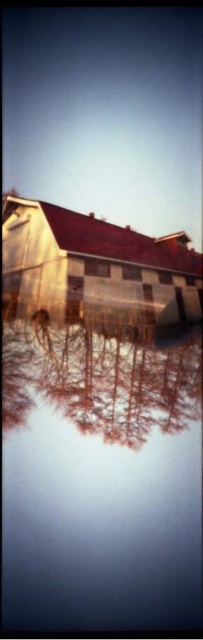
Between transparent glass water at center and wooden barn at center, which one has more height?

transparent glass water at center is taller.

Is point (143, 426) positioned after point (87, 216)?

That is False.

The width and height of the screenshot is (203, 640). I want to click on transparent glass water at center, so click(101, 484).

What are the coordinates of `transparent glass water at center` in the screenshot? It's located at (101, 484).

Can you confirm if transparent glass water at center is taller than smooth glass trees at center?

Correct, transparent glass water at center is much taller as smooth glass trees at center.

Who is more forward, (167, 401) or (28, 403)?

Positioned in front is point (28, 403).

Locate an element on the screen. The height and width of the screenshot is (640, 203). transparent glass water at center is located at coordinates (101, 484).

Which is more to the right, wooden barn at center or smooth glass trees at center?

Positioned to the right is wooden barn at center.

Which is below, wooden barn at center or smooth glass trees at center?

Positioned lower is smooth glass trees at center.

Identify the location of wooden barn at center. (96, 266).

Locate an element on the screen. wooden barn at center is located at coordinates (96, 266).